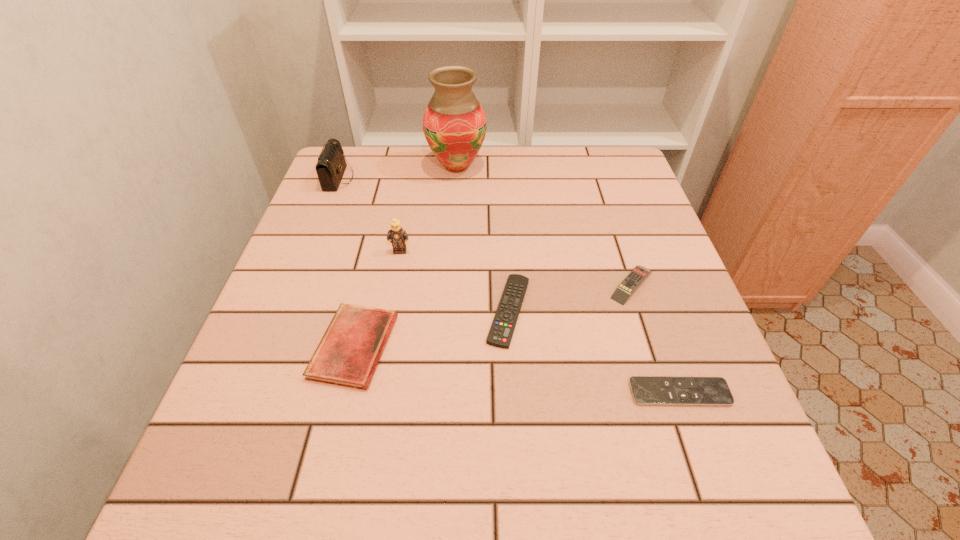
Locate an element on the screen. vacant space in between the nearest remote control and the vase is located at coordinates (568, 280).

Find the location of a particular element. free point between the tallest remote control and the leftmost remote control is located at coordinates click(570, 298).

Identify the location of unoccupied position between the clutch bag and the leftmost remote control. (423, 245).

You are a GUI agent. You are given a task and a screenshot of the screen. Output one action in this format:
    pyautogui.click(x=<x>, y=<y>)
    Task: Click on the free space between the tallest object and the Lego
    The width and height of the screenshot is (960, 540).
    Given the screenshot: What is the action you would take?
    click(x=428, y=209)

Identify the location of vacant point located between the leftmost remote control and the clutch bag. The width and height of the screenshot is (960, 540). (423, 245).

The width and height of the screenshot is (960, 540). Identify the location of empty space that is in between the fifth nearest object and the second shortest object. (454, 281).

This screenshot has width=960, height=540. Find the location of `vacant space that is in between the tallest remote control and the vase`. vacant space that is in between the tallest remote control and the vase is located at coordinates (544, 226).

Find the location of a particular element. The width and height of the screenshot is (960, 540). object that is the closest to the shortest remote control is located at coordinates (500, 335).

This screenshot has height=540, width=960. I want to click on object that is the fourth closest one to the shortest object, so click(x=397, y=235).

Locate which remote control ranks third in proximity to the third farthest object. Please provide its 2D coordinates. Your answer should be formatted as a tuple, i.e. [(x, y)], where the tuple contains the x and y coordinates of a point satisfying the conditions above.

[(646, 390)]